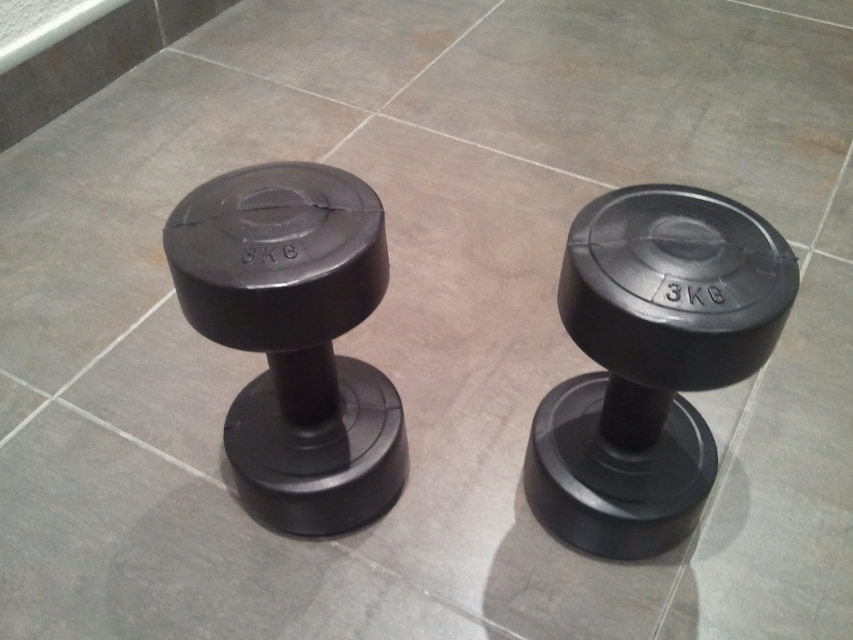
Is matte black dumbbell at center below matte black dumbbell at left?

Correct, matte black dumbbell at center is located below matte black dumbbell at left.

At what (x,y) coordinates should I click in order to perform the action: click on matte black dumbbell at center. Please return your answer as a coordinate pair (x, y). This screenshot has height=640, width=853. Looking at the image, I should click on (650, 362).

Is point (737, 348) in front of point (186, 195)?

Yes, it is in front of point (186, 195).

Locate an element on the screen. The height and width of the screenshot is (640, 853). matte black dumbbell at center is located at coordinates (650, 362).